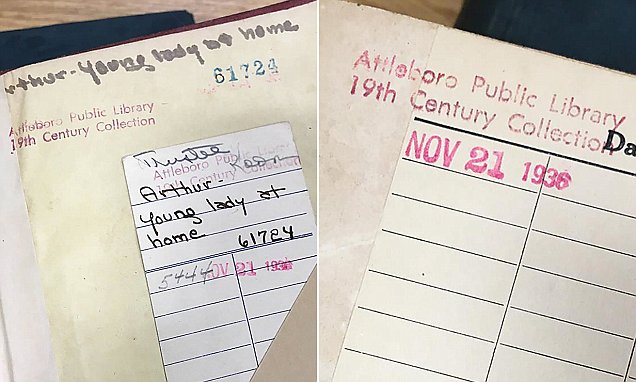
The height and width of the screenshot is (382, 636). What are the coordinates of `wood grain table` in the screenshot? It's located at (13, 10).